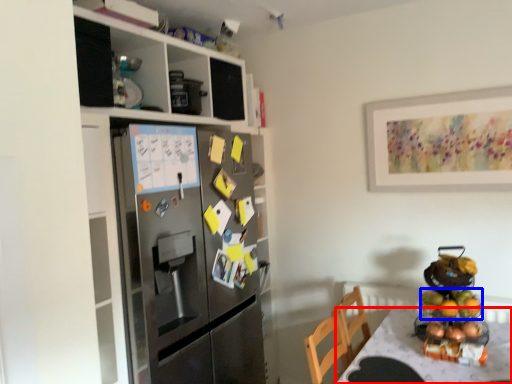
Question: Which point is further to the camera, desk (highlighted by a red box) or fruit (highlighted by a blue box)?

Choices:
 (A) desk
 (B) fruit

Answer: (B)